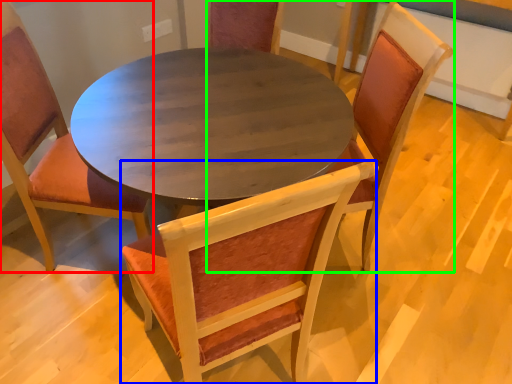
Question: Based on their relative distances, which object is nearer to chair (highlighted by a red box)? Choose from chair (highlighted by a blue box) and chair (highlighted by a green box).

Choices:
 (A) chair
 (B) chair

Answer: (A)